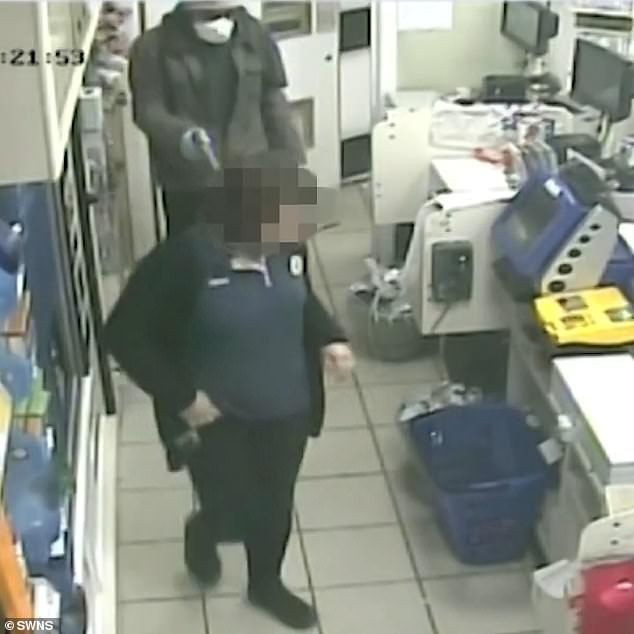
You are a GUI agent. You are given a task and a screenshot of the screen. Output one action in this format:
    pyautogui.click(x=<x>, y=<y>)
    Task: Click on the register
    
    Given the screenshot: What is the action you would take?
    (522, 75), (574, 136)